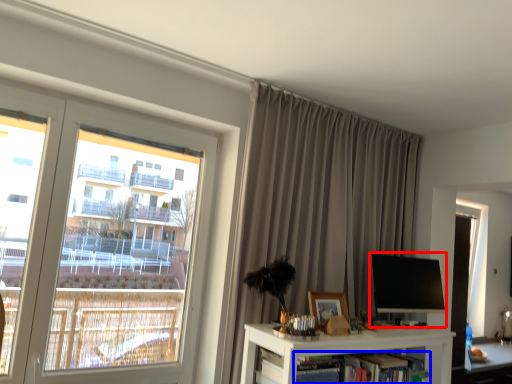
Question: Which point is closer to the camera, computer monitor (highlighted by a red box) or book (highlighted by a blue box)?

Choices:
 (A) computer monitor
 (B) book

Answer: (B)